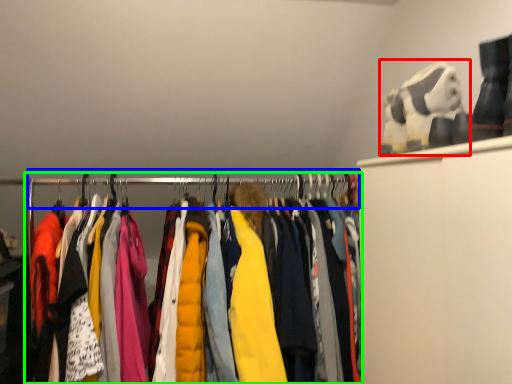
Question: Which is farther away from toy (highlighted by a red box)? clothesline (highlighted by a blue box) or closet (highlighted by a green box)?

Choices:
 (A) clothesline
 (B) closet

Answer: (B)